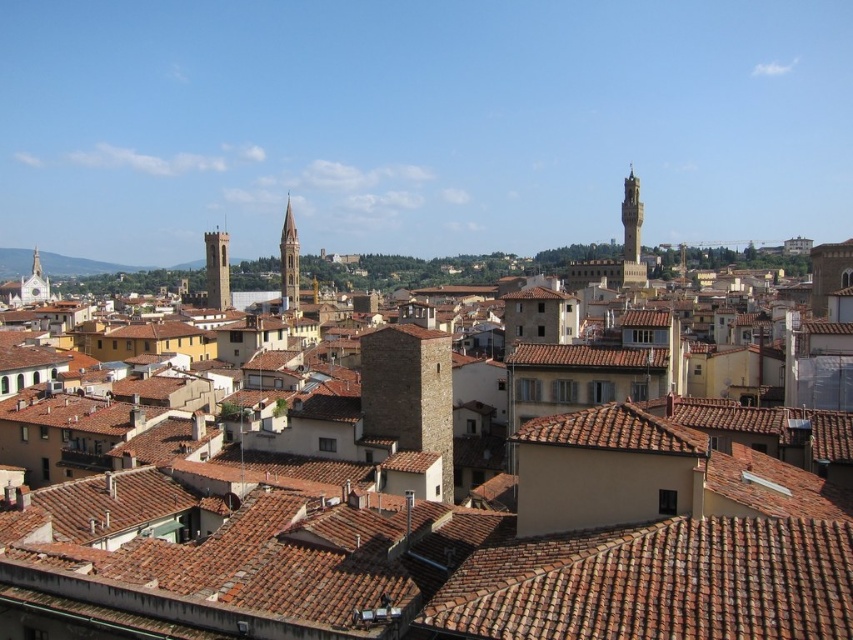
Which of these two, brown stone tower at center-left or white stone tower at left, stands taller?

white stone tower at left

Between brown stone tower at center-left and white stone tower at left, which one appears on the right side from the viewer's perspective?

From the viewer's perspective, brown stone tower at center-left appears more on the right side.

The height and width of the screenshot is (640, 853). I want to click on brown stone tower at center-left, so click(x=216, y=269).

Describe the element at coordinates (289, 262) in the screenshot. Image resolution: width=853 pixels, height=640 pixels. I see `smooth beige tower at center` at that location.

Which is in front, point (297, 304) or point (30, 280)?

Point (297, 304) is more forward.

Locate an element on the screen. smooth beige tower at center is located at coordinates coord(289,262).

Consider the image. Is brown clay roof tiles at center below brown stone tower at center-left?

Correct, brown clay roof tiles at center is located below brown stone tower at center-left.

Which is more to the left, brown clay roof tiles at center or brown stone tower at center-left?

Positioned to the left is brown stone tower at center-left.

Does point (672, 416) come farther from viewer compared to point (207, 244)?

No, (672, 416) is closer to viewer.

Find the location of `brown clay roof tiles at center`. brown clay roof tiles at center is located at coordinates (444, 541).